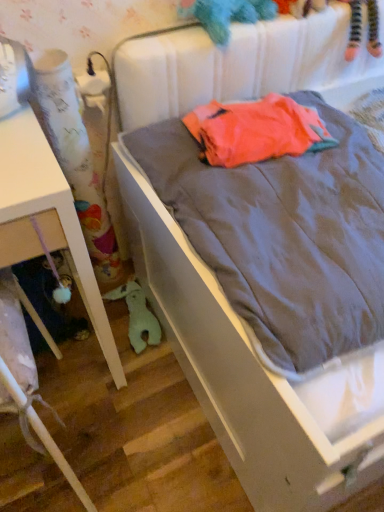
Identify the location of green plush toy at lower left, which appears as the 2th toy when viewed from the front. Image resolution: width=384 pixels, height=512 pixels. coord(137,315).

Image resolution: width=384 pixels, height=512 pixels. What do you see at coordinates (137, 315) in the screenshot? I see `green plush toy at lower left, which ranks as the 1th toy in back-to-front order` at bounding box center [137, 315].

In order to face matte gray bed at center, should I rotate leftwards or rightwards?

Turn right approximately 24.001 degrees to face it.

Describe the element at coordinates (76, 160) in the screenshot. I see `white fabric curtain at left` at that location.

This screenshot has height=512, width=384. I want to click on white fabric curtain at left, so click(76, 160).

Where is `neon orange fabric at center`? The width and height of the screenshot is (384, 512). neon orange fabric at center is located at coordinates (256, 131).

Where is `fluffy teal stuffed animal at upper center, the 1th toy in the front-to-back sequence`? The image size is (384, 512). fluffy teal stuffed animal at upper center, the 1th toy in the front-to-back sequence is located at coordinates (226, 15).

Where is `white matte table at left`? The width and height of the screenshot is (384, 512). white matte table at left is located at coordinates (46, 219).

From a real-world perspective, is white matte table at left physically above white fabric curtain at left?

No.

Is white matte table at left positioned with its back to white fabric curtain at left?

No, white fabric curtain at left is not at the back of white matte table at left.

Between white matte table at left and white fabric curtain at left, which one is positioned behind?

white fabric curtain at left.

Considering the sizes of white matte table at left and white fabric curtain at left in the image, is white matte table at left bigger or smaller than white fabric curtain at left?

Considering their sizes, white matte table at left takes up more space than white fabric curtain at left.

What's the angular difference between neon orange fabric at center and green plush toy at lower left, the 1th toy in the bottom-to-top sequence,'s facing directions?

There is a 6.82-degree angle between the facing directions of neon orange fabric at center and green plush toy at lower left, the 1th toy in the bottom-to-top sequence.

Is neon orange fabric at center looking in the opposite direction of green plush toy at lower left, which appears as the 2th toy when viewed from the front?

No, green plush toy at lower left, which appears as the 2th toy when viewed from the front, is not at the back of neon orange fabric at center.

From the image's perspective, is neon orange fabric at center located above green plush toy at lower left, which appears as the 2th toy when viewed from the front?

Yes, from the image's perspective, neon orange fabric at center is on top of green plush toy at lower left, which appears as the 2th toy when viewed from the front.

Considering the relative sizes of neon orange fabric at center and green plush toy at lower left, the 1th toy in the bottom-to-top sequence, in the image provided, is neon orange fabric at center shorter than green plush toy at lower left, the 1th toy in the bottom-to-top sequence,?

No.

Is matte gray bed at center with white matte table at left?

No, matte gray bed at center is not next to white matte table at left.

Considering the positions of point (245, 97) and point (103, 338), is point (245, 97) closer or farther from the camera than point (103, 338)?

Point (245, 97) appears to be farther away from the viewer than point (103, 338).

From a real-world perspective, is matte gray bed at center located higher than white matte table at left?

Yes, from a real-world perspective, matte gray bed at center is above white matte table at left.

Is fluffy teal stuffed animal at upper center, the second toy when ordered from left to right, positioned beyond the bounds of white matte table at left?

Absolutely, fluffy teal stuffed animal at upper center, the second toy when ordered from left to right, is external to white matte table at left.

Considering the sizes of fluffy teal stuffed animal at upper center, the 1th toy in the front-to-back sequence, and white matte table at left in the image, is fluffy teal stuffed animal at upper center, the 1th toy in the front-to-back sequence, wider or thinner than white matte table at left?

Considering their sizes, fluffy teal stuffed animal at upper center, the 1th toy in the front-to-back sequence, looks slimmer than white matte table at left.

Is fluffy teal stuffed animal at upper center, the 1th toy in the front-to-back sequence, next to white matte table at left?

No, fluffy teal stuffed animal at upper center, the 1th toy in the front-to-back sequence, is not touching white matte table at left.

The image size is (384, 512). I want to click on table lying in front of the fluffy teal stuffed animal at upper center, marked as the 1th toy in a right-to-left arrangement, so click(x=46, y=219).

Is green plush toy at lower left, which is the 2th toy from top to bottom, wider than neon orange fabric at center?

Correct, the width of green plush toy at lower left, which is the 2th toy from top to bottom, exceeds that of neon orange fabric at center.

In the scene shown: Can you confirm if green plush toy at lower left, which ranks as the 1th toy in back-to-front order, is positioned to the right of neon orange fabric at center?

Incorrect, green plush toy at lower left, which ranks as the 1th toy in back-to-front order, is not on the right side of neon orange fabric at center.

Is green plush toy at lower left, which is the 2th toy from top to bottom, further to the viewer compared to neon orange fabric at center?

Yes.

Which is behind, white matte table at left or neon orange fabric at center?

Positioned behind is neon orange fabric at center.

Considering the points (41, 186) and (243, 112), which point is in front, point (41, 186) or point (243, 112)?

Point (41, 186)

Is white matte table at left in contact with neon orange fabric at center?

No, white matte table at left is not with neon orange fabric at center.

Can you confirm if fluffy teal stuffed animal at upper center, which is the 2th toy from bottom to top, is smaller than white fabric curtain at left?

Yes.

Would you consider fluffy teal stuffed animal at upper center, which is the 2th toy from bottom to top, to be distant from white fabric curtain at left?

That's not correct — fluffy teal stuffed animal at upper center, which is the 2th toy from bottom to top, is a little close to white fabric curtain at left.

From the picture: Who is shorter, fluffy teal stuffed animal at upper center, which ranks as the 2th toy in back-to-front order, or white fabric curtain at left?

fluffy teal stuffed animal at upper center, which ranks as the 2th toy in back-to-front order.

Locate an element on the screen. This screenshot has width=384, height=512. curtain above the white matte table at left (from the image's perspective) is located at coordinates [x=76, y=160].

Starting from the neon orange fabric at center, which toy is the 2nd one behind? Please provide its 2D coordinates.

[(137, 315)]

When comparing their distances from white matte table at left, does matte gray bed at center or white fabric curtain at left seem further?

matte gray bed at center.

From the image, which object appears to be nearer to fluffy teal stuffed animal at upper center, the 1th toy in the front-to-back sequence, neon orange fabric at center or matte gray bed at center?

The object closer to fluffy teal stuffed animal at upper center, the 1th toy in the front-to-back sequence, is neon orange fabric at center.

Estimate the real-world distances between objects in this image. Which object is further from fluffy teal stuffed animal at upper center, marked as the 1th toy in a right-to-left arrangement, green plush toy at lower left, the second toy in the right-to-left sequence, or matte gray bed at center?

Among the two, green plush toy at lower left, the second toy in the right-to-left sequence, is located further to fluffy teal stuffed animal at upper center, marked as the 1th toy in a right-to-left arrangement.

From the image, which object appears to be farther from white fabric curtain at left, neon orange fabric at center or white matte table at left?

neon orange fabric at center.

Consider the image. Looking at the image, which one is located closer to white matte table at left, neon orange fabric at center or fluffy teal stuffed animal at upper center, marked as the 1th toy in a right-to-left arrangement?

neon orange fabric at center lies closer to white matte table at left than the other object.

Estimate the real-world distances between objects in this image. Which object is further from green plush toy at lower left, which ranks as the 1th toy in back-to-front order, white matte table at left or fluffy teal stuffed animal at upper center, which is the 2th toy from bottom to top?

The object further to green plush toy at lower left, which ranks as the 1th toy in back-to-front order, is fluffy teal stuffed animal at upper center, which is the 2th toy from bottom to top.

From the image, which object appears to be farther from fluffy teal stuffed animal at upper center, which is the 2th toy from bottom to top, matte gray bed at center or white matte table at left?

white matte table at left lies further to fluffy teal stuffed animal at upper center, which is the 2th toy from bottom to top, than the other object.

From the image, which object appears to be farther from green plush toy at lower left, the second toy in the right-to-left sequence, fluffy teal stuffed animal at upper center, the 1th toy in the front-to-back sequence, or matte gray bed at center?

The object further to green plush toy at lower left, the second toy in the right-to-left sequence, is fluffy teal stuffed animal at upper center, the 1th toy in the front-to-back sequence.

This screenshot has height=512, width=384. Find the location of `curtain between neon orange fabric at center and green plush toy at lower left, which ranks as the 1th toy in back-to-front order, in the vertical direction`. curtain between neon orange fabric at center and green plush toy at lower left, which ranks as the 1th toy in back-to-front order, in the vertical direction is located at coordinates (76, 160).

Where is `baby clothe between fluffy teal stuffed animal at upper center, which ranks as the 2th toy in back-to-front order, and green plush toy at lower left, acting as the 1th toy starting from the left, from top to bottom`? baby clothe between fluffy teal stuffed animal at upper center, which ranks as the 2th toy in back-to-front order, and green plush toy at lower left, acting as the 1th toy starting from the left, from top to bottom is located at coordinates (256, 131).

This screenshot has height=512, width=384. Find the location of `baby clothe situated between white matte table at left and matte gray bed at center from left to right`. baby clothe situated between white matte table at left and matte gray bed at center from left to right is located at coordinates (256, 131).

The image size is (384, 512). I want to click on curtain between matte gray bed at center and green plush toy at lower left, the second toy in the right-to-left sequence, from front to back, so coord(76,160).